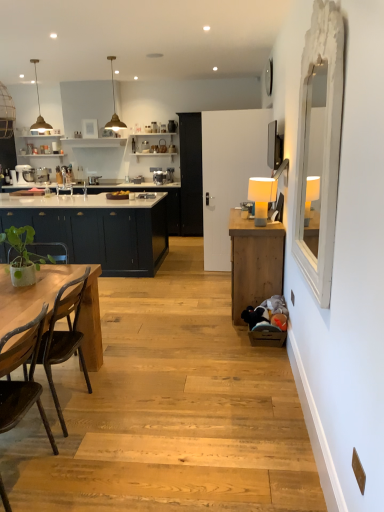
Measure the distance between matte dark blue cabinets at left, the 2th cabinetry when ordered from front to back, and camera.

matte dark blue cabinets at left, the 2th cabinetry when ordered from front to back, and camera are 4.53 meters apart.

In order to face matte dark blue cabinets at left, the 2th cabinetry positioned from the right, should I rotate leftwards or rightwards?

To face it directly, rotate left by 16.639 degrees.

The height and width of the screenshot is (512, 384). Describe the element at coordinates (114, 106) in the screenshot. I see `gold metallic pendant light at upper center, the second lamp when ordered from back to front` at that location.

Describe the element at coordinates (23, 255) in the screenshot. I see `green matte plant at left` at that location.

Describe the element at coordinates (319, 147) in the screenshot. The width and height of the screenshot is (384, 512). I see `white wooden mirror at right` at that location.

Measure the distance between point [44,318] and camera.

Point [44,318] is 2.06 meters from camera.

Measure the distance between matte white sink at center and camera.

The distance of matte white sink at center from camera is 5.19 meters.

In order to click on matte dark blue cabinets at left, the first cabinetry viewed from the left in this screenshot , I will do `click(99, 230)`.

Is matte white sink at center in front of or behind wooden cabinet at right, arranged as the first cabinetry when viewed from the front, in the image?

matte white sink at center is behind wooden cabinet at right, arranged as the first cabinetry when viewed from the front.

Is matte white sink at center taller or shorter than wooden cabinet at right, the 1th cabinetry when ordered from right to left?

Clearly, matte white sink at center is shorter compared to wooden cabinet at right, the 1th cabinetry when ordered from right to left.

Is matte white sink at center positioned far away from wooden cabinet at right, arranged as the first cabinetry when viewed from the front?

Yes, matte white sink at center and wooden cabinet at right, arranged as the first cabinetry when viewed from the front, are located far from each other.

Considering the relative positions of matte dark blue cabinets at left, the 2th cabinetry when ordered from front to back, and white fabric lampshade at upper right, which is the third lamp from back to front, in the image provided, is matte dark blue cabinets at left, the 2th cabinetry when ordered from front to back, to the left of white fabric lampshade at upper right, which is the third lamp from back to front, from the viewer's perspective?

Correct, you'll find matte dark blue cabinets at left, the 2th cabinetry when ordered from front to back, to the left of white fabric lampshade at upper right, which is the third lamp from back to front.

Measure the distance from matte dark blue cabinets at left, the first cabinetry viewed from the left, to white fabric lampshade at upper right, which is counted as the third lamp, starting from the top.

A distance of 1.89 meters exists between matte dark blue cabinets at left, the first cabinetry viewed from the left, and white fabric lampshade at upper right, which is counted as the third lamp, starting from the top.

Can you confirm if matte dark blue cabinets at left, the 2th cabinetry positioned from the right, is taller than white fabric lampshade at upper right, which is the 1th lamp in front-to-back order?

Correct, matte dark blue cabinets at left, the 2th cabinetry positioned from the right, is much taller as white fabric lampshade at upper right, which is the 1th lamp in front-to-back order.

How many degrees apart are the facing directions of matte dark blue cabinets at left, the first cabinetry viewed from the left, and white fabric lampshade at upper right, marked as the first lamp in a right-to-left arrangement?

There is a 88.1-degree angle between the facing directions of matte dark blue cabinets at left, the first cabinetry viewed from the left, and white fabric lampshade at upper right, marked as the first lamp in a right-to-left arrangement.

Does point (112, 119) come farther from viewer compared to point (58, 189)?

That is True.

Is matte white sink at center a part of gold metallic pendant light at upper center, the second lamp from the left?

Definitely not — matte white sink at center is not inside gold metallic pendant light at upper center, the second lamp from the left.

Identify the location of sink that is behind the green matte plant at left. The height and width of the screenshot is (512, 384). (63, 181).

Are green matte plant at left and matte white sink at center far apart?

green matte plant at left is far away from matte white sink at center.

Is green matte plant at left shorter than matte white sink at center?

Incorrect, the height of green matte plant at left does not fall short of that of matte white sink at center.

Measure the distance between green matte plant at left and matte white sink at center.

A distance of 2.61 meters exists between green matte plant at left and matte white sink at center.

From a real-world perspective, is matte white sink at center on green matte plant at left?

Yes, from a real-world perspective, matte white sink at center is above green matte plant at left.

Considering the sizes of objects matte white sink at center and green matte plant at left in the image provided, who is taller, matte white sink at center or green matte plant at left?

green matte plant at left.

In the scene shown: Would you say matte white sink at center is outside green matte plant at left?

Yes, matte white sink at center is located beyond the bounds of green matte plant at left.

Considering their positions, is wooden cabinet at right, the 1th cabinetry when ordered from right to left, located in front of or behind matte dark blue cabinets at left, the first cabinetry from the back?

In the image, wooden cabinet at right, the 1th cabinetry when ordered from right to left, appears in front of matte dark blue cabinets at left, the first cabinetry from the back.

Is matte dark blue cabinets at left, the 2th cabinetry positioned from the right, at the back of wooden cabinet at right, the 1th cabinetry when ordered from right to left?

No, wooden cabinet at right, the 1th cabinetry when ordered from right to left,'s orientation is not away from matte dark blue cabinets at left, the 2th cabinetry positioned from the right.

Is wooden cabinet at right, the 2th cabinetry in the back-to-front sequence, bigger or smaller than matte dark blue cabinets at left, the 2th cabinetry positioned from the right?

Considering their sizes, wooden cabinet at right, the 2th cabinetry in the back-to-front sequence, takes up less space than matte dark blue cabinets at left, the 2th cabinetry positioned from the right.

From a real-world perspective, which is physically above, wooden cabinet at right, arranged as the first cabinetry when viewed from the front, or matte dark blue cabinets at left, the 2th cabinetry positioned from the right?

matte dark blue cabinets at left, the 2th cabinetry positioned from the right, is physically above.

In the scene shown: Measure the distance between gold metallic pendant light at upper center, the second lamp from the left, and matte dark blue cabinets at left, the first cabinetry viewed from the left.

gold metallic pendant light at upper center, the second lamp from the left, is 2.78 meters from matte dark blue cabinets at left, the first cabinetry viewed from the left.

Which of these two, gold metallic pendant light at upper center, which appears as the second lamp when viewed from the right, or matte dark blue cabinets at left, the first cabinetry viewed from the left, is thinner?

gold metallic pendant light at upper center, which appears as the second lamp when viewed from the right, is thinner.

Between gold metallic pendant light at upper center, the second lamp when ordered from back to front, and matte dark blue cabinets at left, the 2th cabinetry when ordered from front to back, which one has more height?

Standing taller between the two is matte dark blue cabinets at left, the 2th cabinetry when ordered from front to back.

Which is in front, point (118, 117) or point (126, 224)?

The point (126, 224) is in front.

At what (x,y) coordinates should I click in order to perform the action: click on cabinetry that is the 2nd object located in front of the matte white sink at center. Please return your answer as a coordinate pair (x, y). Looking at the image, I should click on (x=254, y=262).

Where is `the 1st cabinetry located beneath the white fabric lampshade at upper right, the third lamp positioned from the left (from a real-world perspective)`? The width and height of the screenshot is (384, 512). the 1st cabinetry located beneath the white fabric lampshade at upper right, the third lamp positioned from the left (from a real-world perspective) is located at coordinates (99, 230).

Based on their spatial positions, is matte dark blue cabinets at left, the first cabinetry from the back, or gold textured pendant light at upper left, acting as the 1th lamp starting from the back, closer to matte white sink at center?

matte dark blue cabinets at left, the first cabinetry from the back.

Estimate the real-world distances between objects in this image. Which object is closer to green matte plant at left, matte white sink at center or dark brown wooden chair at lower left?

dark brown wooden chair at lower left.

When comparing their distances from matte white sink at center, does dark brown wooden chair at lower left or gold textured pendant light at upper left, acting as the 3th lamp starting from the bottom, seem closer?

gold textured pendant light at upper left, acting as the 3th lamp starting from the bottom.

Looking at the image, which one is located further to natural wood table at left, gold metallic pendant light at upper center, the second lamp from the left, or gold textured pendant light at upper left, acting as the 3th lamp starting from the bottom?

gold textured pendant light at upper left, acting as the 3th lamp starting from the bottom.

Based on their spatial positions, is gold textured pendant light at upper left, acting as the 1th lamp starting from the top, or wooden cabinet at right, arranged as the first cabinetry when viewed from the front, closer to matte dark blue cabinets at left, the 2th cabinetry positioned from the right?

Among the two, wooden cabinet at right, arranged as the first cabinetry when viewed from the front, is located nearer to matte dark blue cabinets at left, the 2th cabinetry positioned from the right.

When comparing their distances from gold textured pendant light at upper left, placed as the 3th lamp when sorted from right to left, does natural wood table at left or matte white sink at center seem further?

natural wood table at left lies further to gold textured pendant light at upper left, placed as the 3th lamp when sorted from right to left, than the other object.

When comparing their distances from natural wood table at left, does white wooden mirror at right or gold textured pendant light at upper left, acting as the 3th lamp starting from the front, seem closer?

white wooden mirror at right is positioned closer to the anchor natural wood table at left.

From the image, which object appears to be nearer to white fabric lampshade at upper right, which is counted as the third lamp, starting from the top, matte white sink at center or green matte plant at left?

green matte plant at left is positioned closer to the anchor white fabric lampshade at upper right, which is counted as the third lamp, starting from the top.

What are the coordinates of `plant between dark brown wooden chair at lower left and gold textured pendant light at upper left, placed as the 3th lamp when sorted from right to left, in the front-back direction` in the screenshot? It's located at (23, 255).

The image size is (384, 512). Identify the location of lamp between gold metallic pendant light at upper center, which is the second lamp from front to back, and wooden cabinet at right, arranged as the first cabinetry when viewed from the front, in the up-down direction. (262, 197).

The height and width of the screenshot is (512, 384). In order to click on chair between white wooden mirror at right and matte dark blue cabinets at left, the 2th cabinetry positioned from the right, along the z-axis in this screenshot , I will do `click(22, 381)`.

Where is `kitchen & dining room table between dark brown wooden chair at lower left and matte white sink at center from front to back`? This screenshot has width=384, height=512. kitchen & dining room table between dark brown wooden chair at lower left and matte white sink at center from front to back is located at coordinates coord(32,295).